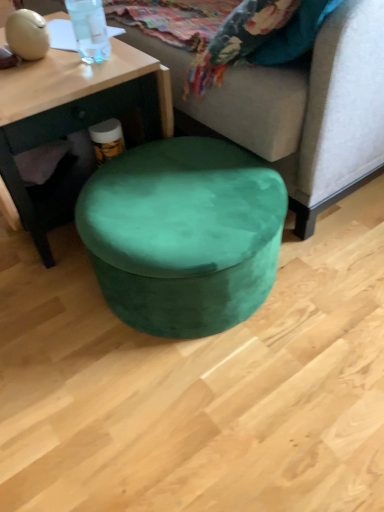
This screenshot has height=512, width=384. Identify the location of vacant space situated above velvet green ottoman at center (from a real-world perspective). (180, 189).